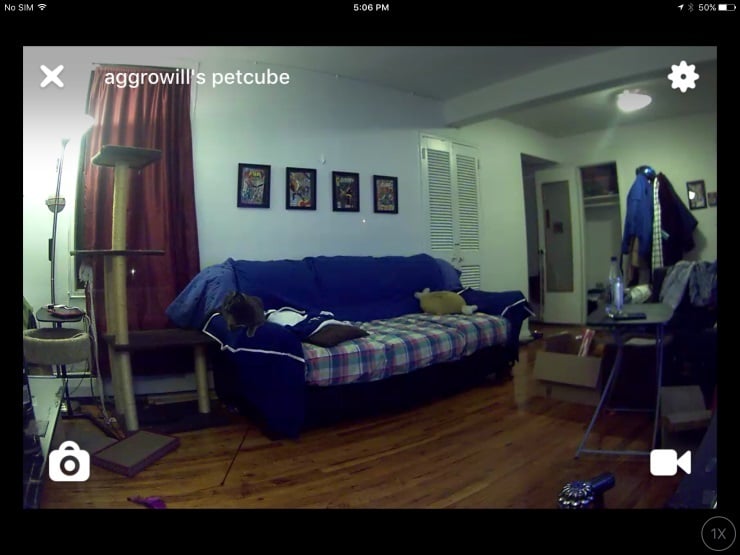
Identify the location of wooden bare floor. This screenshot has width=740, height=555. (541, 407), (192, 454), (195, 498), (450, 508), (553, 463).